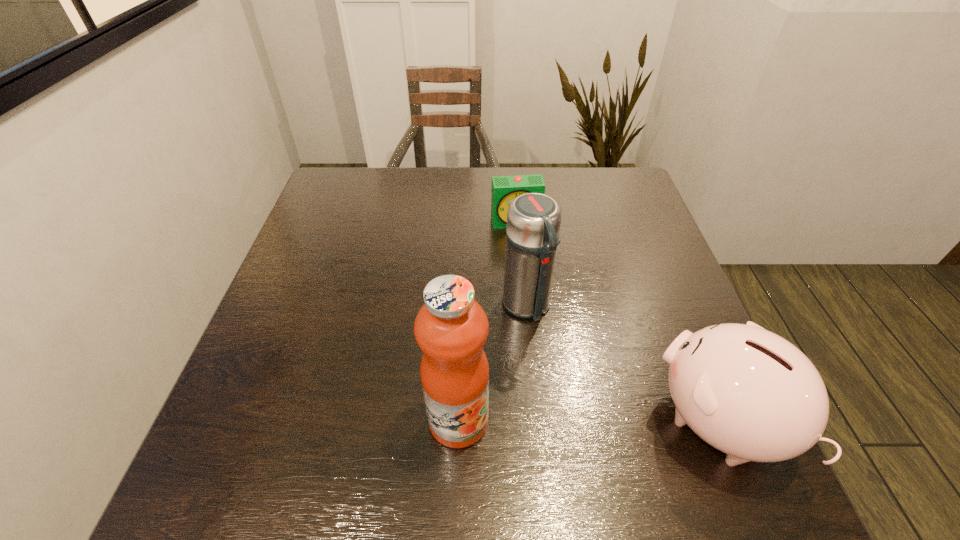
Identify the location of free space on the desktop that is between the fruit juice and the rightmost object and is positioned on the front-facing side of the alarm clock. (564, 421).

Identify the location of free space on the desktop that is between the leftmost object and the rightmost object and is positioned with a handle on the side of the second tallest object. This screenshot has height=540, width=960. (598, 421).